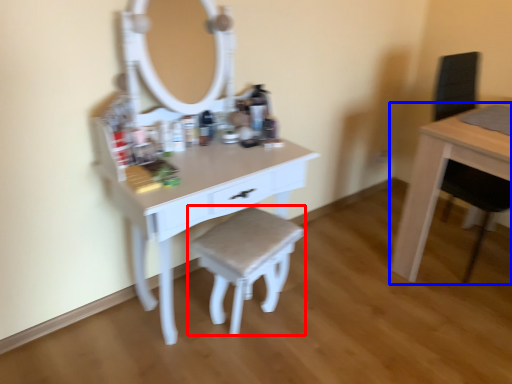
Question: Which of the following is the closest to the observer, stool (highlighted by a red box) or table (highlighted by a blue box)?

Choices:
 (A) stool
 (B) table

Answer: (A)